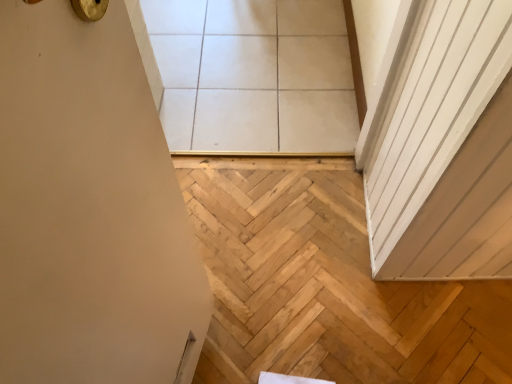
What do you see at coordinates (254, 75) in the screenshot? The height and width of the screenshot is (384, 512). I see `white glossy tile at upper center` at bounding box center [254, 75].

You are a GUI agent. You are given a task and a screenshot of the screen. Output one action in this format:
    pyautogui.click(x=<x>, y=<y>)
    Task: Click on the white glossy tile at upper center
    This screenshot has height=384, width=512.
    Given the screenshot: What is the action you would take?
    pyautogui.click(x=254, y=75)

What do you see at coordinates (326, 285) in the screenshot? This screenshot has height=384, width=512. I see `natural wood stairwell at lower right` at bounding box center [326, 285].

Find the location of a particular element. natural wood stairwell at lower right is located at coordinates (326, 285).

I want to click on white glossy tile at upper center, so click(x=254, y=75).

Between white glossy tile at upper center and natural wood stairwell at lower right, which one appears on the right side from the viewer's perspective?

Positioned to the right is natural wood stairwell at lower right.

Which is in front, white glossy tile at upper center or natural wood stairwell at lower right?

natural wood stairwell at lower right is in front.

Is point (307, 34) less distant than point (298, 283)?

That is False.

From the image's perspective, which one is positioned lower, white glossy tile at upper center or natural wood stairwell at lower right?

natural wood stairwell at lower right.

From a real-world perspective, between white glossy tile at upper center and natural wood stairwell at lower right, who is vertically lower?

natural wood stairwell at lower right.

Which object is thinner, white glossy tile at upper center or natural wood stairwell at lower right?

Thinner between the two is natural wood stairwell at lower right.

Which of these two, white glossy tile at upper center or natural wood stairwell at lower right, stands shorter?

With less height is white glossy tile at upper center.

Which of these two, white glossy tile at upper center or natural wood stairwell at lower right, is bigger?

white glossy tile at upper center.

Does white glossy tile at upper center contain natural wood stairwell at lower right?

No, white glossy tile at upper center does not contain natural wood stairwell at lower right.

Is white glossy tile at upper center with natural wood stairwell at lower right?

No, white glossy tile at upper center is not touching natural wood stairwell at lower right.

Is white glossy tile at upper center aimed at natural wood stairwell at lower right?

Yes, white glossy tile at upper center is oriented towards natural wood stairwell at lower right.

How many degrees apart are the facing directions of white glossy tile at upper center and natural wood stairwell at lower right?

180 degrees.

The width and height of the screenshot is (512, 384). There is a natural wood stairwell at lower right. What are the coordinates of `tile above it (from a real-world perspective)` in the screenshot? It's located at (254, 75).

Does natural wood stairwell at lower right appear on the left side of white glossy tile at upper center?

In fact, natural wood stairwell at lower right is to the right of white glossy tile at upper center.

Is natural wood stairwell at lower right closer to camera compared to white glossy tile at upper center?

Yes.

Is point (227, 317) closer or farther from the camera than point (346, 137)?

Point (227, 317) is positioned closer to the camera compared to point (346, 137).

From the image's perspective, is natural wood stairwell at lower right located above white glossy tile at upper center?

Incorrect, from the image's perspective, natural wood stairwell at lower right is lower than white glossy tile at upper center.

From a real-world perspective, relative to white glossy tile at upper center, is natural wood stairwell at lower right vertically above or below?

In terms of real-world spatial position, natural wood stairwell at lower right is below white glossy tile at upper center.

Which object is thinner, natural wood stairwell at lower right or white glossy tile at upper center?

natural wood stairwell at lower right.

Considering the relative sizes of natural wood stairwell at lower right and white glossy tile at upper center in the image provided, is natural wood stairwell at lower right taller than white glossy tile at upper center?

Yes.

Does natural wood stairwell at lower right have a smaller size compared to white glossy tile at upper center?

Indeed, natural wood stairwell at lower right has a smaller size compared to white glossy tile at upper center.

Is natural wood stairwell at lower right positioned beyond the bounds of white glossy tile at upper center?

Indeed, natural wood stairwell at lower right is completely outside white glossy tile at upper center.

Is the surface of natural wood stairwell at lower right in direct contact with white glossy tile at upper center?

natural wood stairwell at lower right and white glossy tile at upper center are not in contact.

Is natural wood stairwell at lower right positioned with its back to white glossy tile at upper center?

No, white glossy tile at upper center is not at the back of natural wood stairwell at lower right.

The width and height of the screenshot is (512, 384). Identify the location of stairwell below the white glossy tile at upper center (from the image's perspective). click(326, 285).

Identify the location of tile above the natural wood stairwell at lower right (from the image's perspective). The height and width of the screenshot is (384, 512). (254, 75).

Identify the location of tile positioned vertically above the natural wood stairwell at lower right (from a real-world perspective). (254, 75).